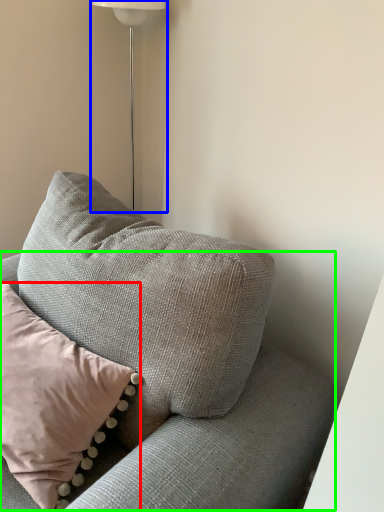
Question: Which is farther away from pillow (highlighted by a red box)? lamp (highlighted by a blue box) or couch (highlighted by a green box)?

Choices:
 (A) lamp
 (B) couch

Answer: (A)